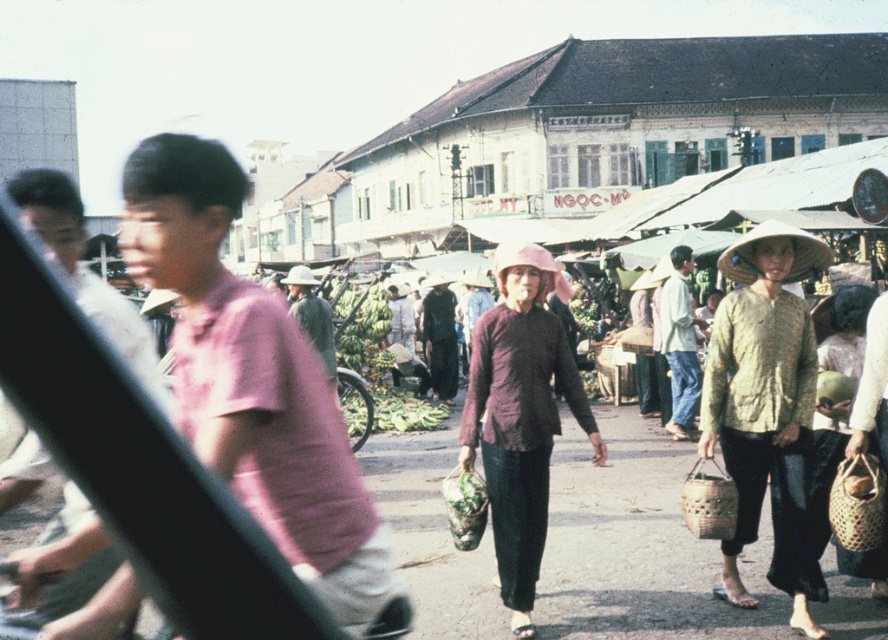
Based on the photo, you are a tailor observing the clothing items in the market scene. You need to determine which clothing item has a narrower width between the pink matte shirt at center and the matte purple blouse at center. Which one is it?

The pink matte shirt at center has a narrower width than the matte purple blouse at center according to the description.

You are standing at the entrance of the market and see the pink matte shirt at center and the textured yellow blouse at center. Which one is closer to you?

The pink matte shirt at center is 4.21 meters away from the textured yellow blouse at center, but the question is about which is closer to you. Since both are at center, their distance from you would depend on their depth. However, the description only provides the distance between them, not their positions relative to the viewer. Therefore, it is impossible to determine which is closer to you based on the given information.

What is located at point (766,408) in the image?

The textured yellow blouse at center is located at point (766,408).